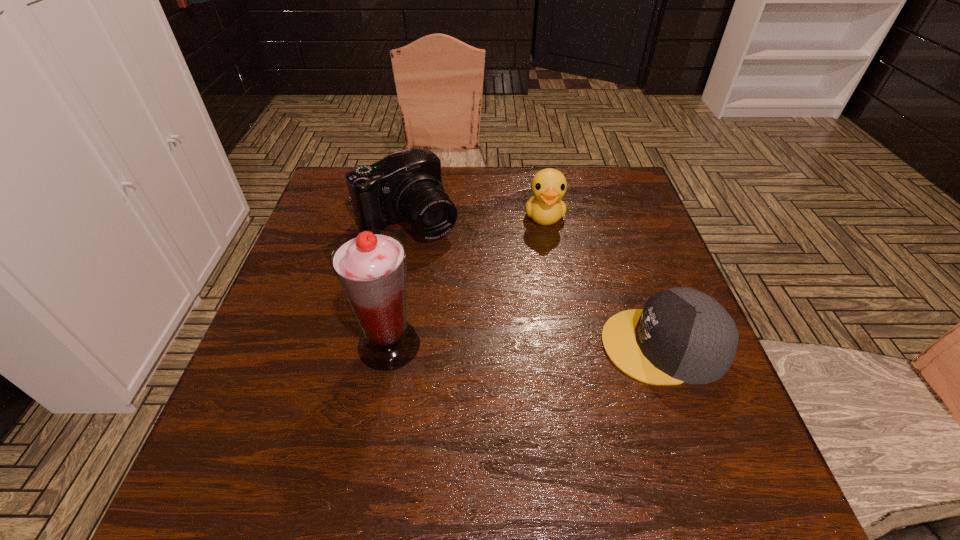
Where is `free space on the desktop that is between the smoothie and the shortest object and is positioned on the lens of the camera`? free space on the desktop that is between the smoothie and the shortest object and is positioned on the lens of the camera is located at coordinates (502, 345).

You are a GUI agent. You are given a task and a screenshot of the screen. Output one action in this format:
    pyautogui.click(x=<x>, y=<y>)
    Task: Click on the free space on the desktop that is between the tallest object and the shortest object and is positioned on the face of the duck
    The image size is (960, 540).
    Given the screenshot: What is the action you would take?
    pyautogui.click(x=558, y=345)